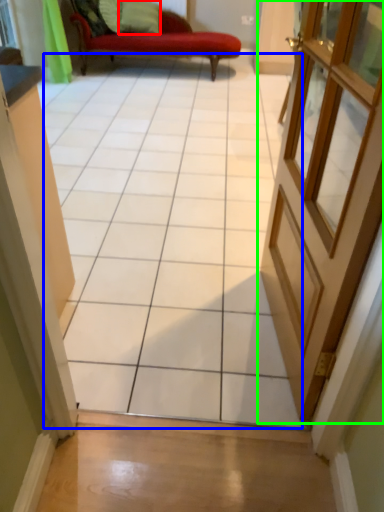
Question: Which is nearer to the pillow (highlighted by a red box)? ceramic tile (highlighted by a blue box) or door (highlighted by a green box).

Choices:
 (A) ceramic tile
 (B) door

Answer: (A)